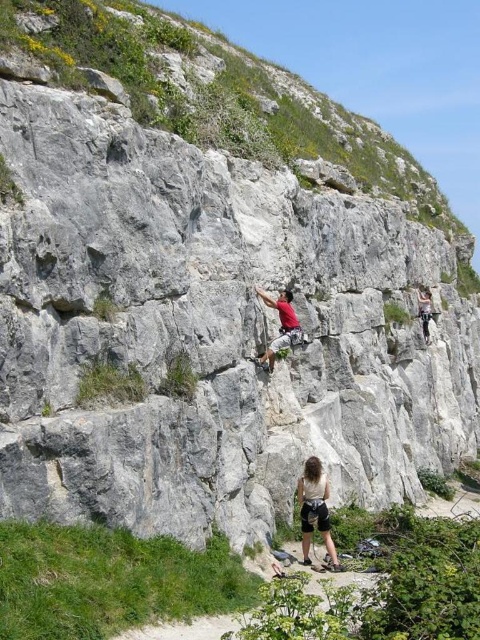
Question: Which of these objects is positioned farthest from the matte red shirt at center?

Choices:
 (A) white rock climbing wall at center
 (B) dark gray fabric pants at center

Answer: (A)

Question: Is dark gray fabric pants at center above matte red shirt at center?

Choices:
 (A) no
 (B) yes

Answer: (A)

Question: Among these points, which one is farthest from the camera?

Choices:
 (A) (300, 337)
 (B) (301, 484)
 (C) (188, 138)

Answer: (A)

Question: Which point is farther to the camera?

Choices:
 (A) (310, 483)
 (B) (134, 92)

Answer: (A)

Question: Can you confirm if dark gray fabric pants at center is positioned to the left of matte red shirt at center?

Choices:
 (A) yes
 (B) no

Answer: (B)

Question: Can you confirm if white rock climbing wall at center is positioned below dark gray fabric pants at center?

Choices:
 (A) no
 (B) yes

Answer: (A)